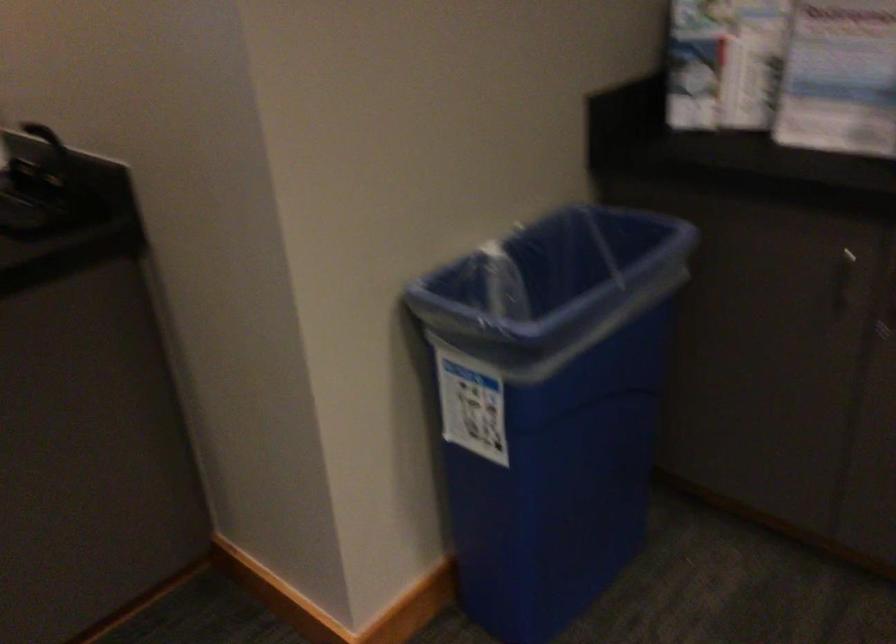
Where is `silver cabinet handle`? silver cabinet handle is located at coordinates (842, 279).